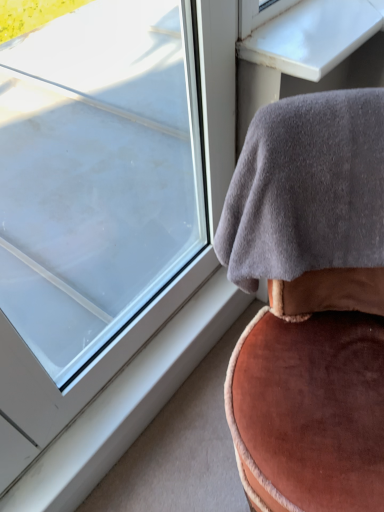
The height and width of the screenshot is (512, 384). Describe the element at coordinates (309, 54) in the screenshot. I see `white glossy table at upper right` at that location.

The height and width of the screenshot is (512, 384). What do you see at coordinates (127, 403) in the screenshot?
I see `white plastic window sill at lower left` at bounding box center [127, 403].

Measure the distance between point (111, 123) and camera.

Point (111, 123) is 2.28 meters from camera.

Locate an element on the screen. The height and width of the screenshot is (512, 384). white glossy table at upper right is located at coordinates (309, 54).

Does gray fleece blanket at upper right have a greater width compared to white glossy table at upper right?

Correct, the width of gray fleece blanket at upper right exceeds that of white glossy table at upper right.

At what (x,y) coordinates should I click in order to perform the action: click on blanket on the left side of white glossy table at upper right. Please return your answer as a coordinate pair (x, y). Looking at the image, I should click on (307, 189).

Does gray fleece blanket at upper right appear on the right side of white glossy table at upper right?

No, gray fleece blanket at upper right is not to the right of white glossy table at upper right.

Is point (383, 253) positioned behind point (244, 48)?

That is True.

Which of these two, white glossy table at upper right or transparent glass window at upper left, stands taller?

transparent glass window at upper left is taller.

From the image's perspective, is white glossy table at upper right over transparent glass window at upper left?

Yes, from the image's perspective, white glossy table at upper right is on top of transparent glass window at upper left.

Is white glossy table at upper right wider than transparent glass window at upper left?

Correct, the width of white glossy table at upper right exceeds that of transparent glass window at upper left.

Is transparent glass window at upper left next to white glossy table at upper right?

transparent glass window at upper left and white glossy table at upper right are not in contact.

Considering the positions of objects transparent glass window at upper left and white glossy table at upper right in the image provided, who is behind, transparent glass window at upper left or white glossy table at upper right?

white glossy table at upper right is further away from the camera.

At what (x,y) coordinates should I click in order to perform the action: click on table behind the transparent glass window at upper left. Please return your answer as a coordinate pair (x, y). Looking at the image, I should click on (309, 54).

From a real-world perspective, which is physically below, transparent glass window at upper left or white glossy table at upper right?

In real-world perspective, transparent glass window at upper left is lower.

Which is less distant, (183, 326) or (319, 118)?

The point (319, 118) is closer to the camera.

Considering the sizes of white plastic window sill at lower left and gray fleece blanket at upper right in the image, is white plastic window sill at lower left taller or shorter than gray fleece blanket at upper right?

white plastic window sill at lower left is shorter than gray fleece blanket at upper right.

Consider the image. Is white plastic window sill at lower left facing towards gray fleece blanket at upper right?

No.

Is white glossy table at upper right bigger than gray fleece blanket at upper right?

Incorrect, white glossy table at upper right is not larger than gray fleece blanket at upper right.

Which object is further away from the camera, white glossy table at upper right or gray fleece blanket at upper right?

Positioned behind is white glossy table at upper right.

Can you tell me how much transparent glass window at upper left and gray fleece blanket at upper right differ in facing direction?

59.5 degrees separate the facing orientations of transparent glass window at upper left and gray fleece blanket at upper right.

Does transparent glass window at upper left have a smaller size compared to gray fleece blanket at upper right?

Incorrect, transparent glass window at upper left is not smaller in size than gray fleece blanket at upper right.

Does transparent glass window at upper left have a greater width compared to gray fleece blanket at upper right?

In fact, transparent glass window at upper left might be narrower than gray fleece blanket at upper right.

At what (x,y) coordinates should I click in order to perform the action: click on blanket above the transparent glass window at upper left (from the image's perspective). Please return your answer as a coordinate pair (x, y). The image size is (384, 512). Looking at the image, I should click on (307, 189).

From the image's perspective, who appears lower, gray fleece blanket at upper right or transparent glass window at upper left?

From the image's view, transparent glass window at upper left is below.

How far apart are gray fleece blanket at upper right and transparent glass window at upper left?

gray fleece blanket at upper right is 98.18 centimeters away from transparent glass window at upper left.

Considering the relative positions of gray fleece blanket at upper right and transparent glass window at upper left in the image provided, is gray fleece blanket at upper right to the left or to the right of transparent glass window at upper left?

gray fleece blanket at upper right is positioned on transparent glass window at upper left's right side.

Can you confirm if gray fleece blanket at upper right is taller than transparent glass window at upper left?

Incorrect, the height of gray fleece blanket at upper right is not larger of that of transparent glass window at upper left.

You are a GUI agent. You are given a task and a screenshot of the screen. Output one action in this format:
    pyautogui.click(x=<x>, y=<y>)
    Task: Click on the table above the gray fleece blanket at upper right (from a real-world perspective)
    This screenshot has height=512, width=384.
    Given the screenshot: What is the action you would take?
    309,54

You are a GUI agent. You are given a task and a screenshot of the screen. Output one action in this format:
    pyautogui.click(x=<x>, y=<y>)
    Task: Click on the window that is in front of the white glossy table at upper right
    
    Given the screenshot: What is the action you would take?
    pyautogui.click(x=108, y=228)

Looking at the image, which one is located closer to transparent glass window at upper left, white plastic window sill at lower left or white glossy table at upper right?

The object closer to transparent glass window at upper left is white plastic window sill at lower left.

Based on their spatial positions, is white glossy table at upper right or transparent glass window at upper left closer to gray fleece blanket at upper right?

The object closer to gray fleece blanket at upper right is white glossy table at upper right.

Considering their positions, is white glossy table at upper right positioned closer to white plastic window sill at lower left than transparent glass window at upper left?

white glossy table at upper right lies closer to white plastic window sill at lower left than the other object.

Estimate the real-world distances between objects in this image. Which object is further from white plastic window sill at lower left, white glossy table at upper right or gray fleece blanket at upper right?

white glossy table at upper right is positioned further to the anchor white plastic window sill at lower left.

Estimate the real-world distances between objects in this image. Which object is further from gray fleece blanket at upper right, white plastic window sill at lower left or white glossy table at upper right?

white plastic window sill at lower left is positioned further to the anchor gray fleece blanket at upper right.

From the image, which object appears to be nearer to gray fleece blanket at upper right, white plastic window sill at lower left or transparent glass window at upper left?

Among the two, white plastic window sill at lower left is located nearer to gray fleece blanket at upper right.

From the image, which object appears to be nearer to gray fleece blanket at upper right, transparent glass window at upper left or white plastic window sill at lower left?

white plastic window sill at lower left is positioned closer to the anchor gray fleece blanket at upper right.

When comparing their distances from white glossy table at upper right, does white plastic window sill at lower left or transparent glass window at upper left seem closer?

Among the two, white plastic window sill at lower left is located nearer to white glossy table at upper right.

At what (x,y) coordinates should I click in order to perform the action: click on window between white glossy table at upper right and white plastic window sill at lower left in the up-down direction. Please return your answer as a coordinate pair (x, y). Looking at the image, I should click on (x=108, y=228).

The image size is (384, 512). I want to click on blanket between transparent glass window at upper left and white plastic window sill at lower left from front to back, so click(x=307, y=189).

This screenshot has height=512, width=384. What are the coordinates of `blanket between white glossy table at upper right and white plastic window sill at lower left in the vertical direction` in the screenshot? It's located at (307, 189).

Image resolution: width=384 pixels, height=512 pixels. I want to click on blanket between transparent glass window at upper left and white glossy table at upper right in the front-back direction, so click(x=307, y=189).